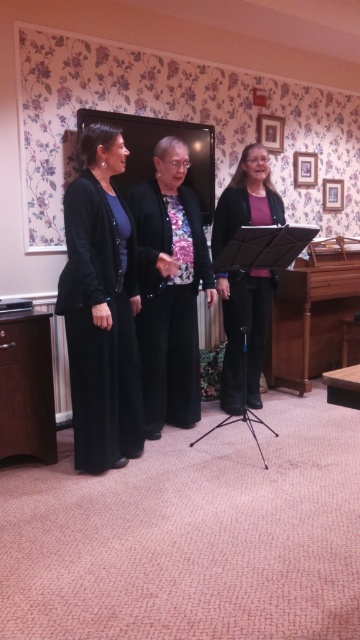
You are standing in the room and want to move from the point at coordinates point (169, 358) to the point at coordinates point (272, 216). Can you walk directly towards the second point without needing to go around any obstacles?

Since point (169, 358) is in front of point (272, 216), you can walk directly towards the second point without needing to go around any obstacles.

You are a fashion designer observing the two black jackets in the image. Which one is shorter in height between the black matte blazer at center and the matte black jacket at center?

The black matte blazer at center is shorter in height compared to the matte black jacket at center according to the description.

You are standing in the room and want to place a small decoration at the point marked as point (100,330). Which object is this point located on?

The point (100,330) is located on the black matte suit at left.